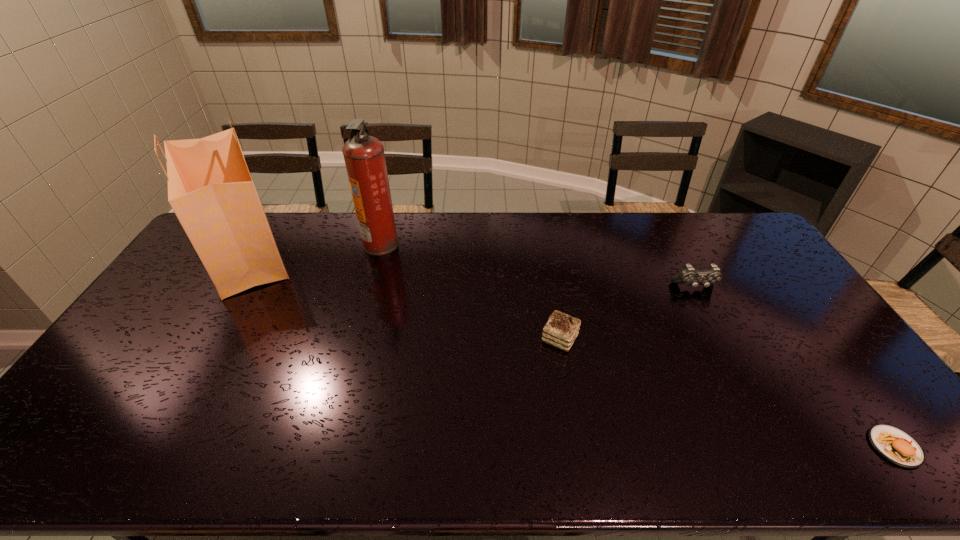
In the image, there is a desktop. In order to click on vacant space at the far edge in this screenshot , I will do `click(692, 224)`.

This screenshot has height=540, width=960. In the image, there is a desktop. Identify the location of vacant region at the near edge. coord(314,456).

Find the location of `blank space at the left edge of the desktop`. blank space at the left edge of the desktop is located at coordinates (122, 406).

Where is `vacant space at the right edge of the desktop`? This screenshot has height=540, width=960. vacant space at the right edge of the desktop is located at coordinates (826, 372).

Identify the location of free space between the leftmost object and the shortest object. (571, 351).

Find the location of a particular element. This screenshot has width=960, height=540. unoccupied position between the fourth object from left to right and the grocery bag is located at coordinates pyautogui.click(x=470, y=271).

Identify the location of vacant region between the patty and the second object from right to left. The width and height of the screenshot is (960, 540). click(x=795, y=367).

In order to click on free area in between the grocery bag and the fourth object from right to left in this screenshot , I will do `click(314, 249)`.

You are a GUI agent. You are given a task and a screenshot of the screen. Output one action in this format:
    pyautogui.click(x=<x>, y=<y>)
    Task: Click on the empty space that is in between the second object from left to right and the leftmost object
    Image resolution: width=960 pixels, height=540 pixels.
    Given the screenshot: What is the action you would take?
    pyautogui.click(x=314, y=249)

In order to click on free spot between the fourth object from left to right and the fourth tallest object in this screenshot , I will do `click(627, 313)`.